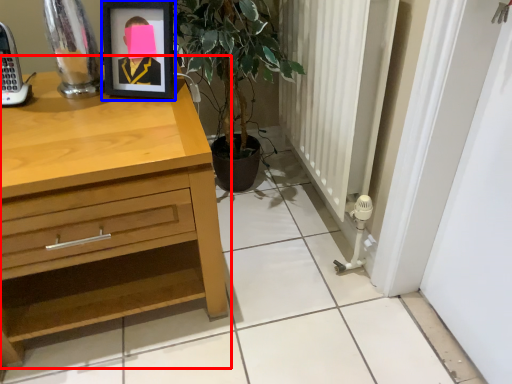
Question: Among these objects, which one is farthest to the camera, chest of drawers (highlighted by a red box) or picture frame (highlighted by a blue box)?

Choices:
 (A) chest of drawers
 (B) picture frame

Answer: (B)